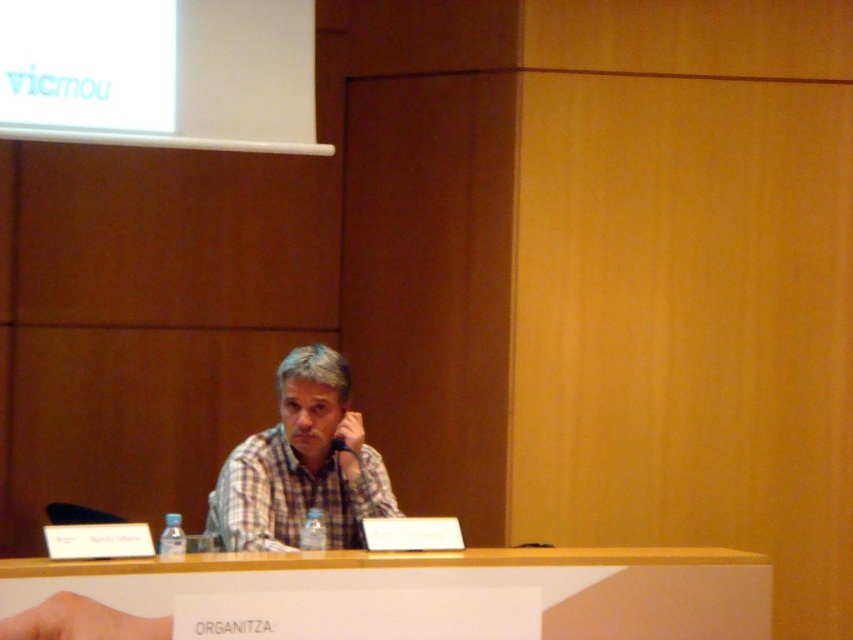
Consider the image. You are organizing a small event and need to place a 1.2 meter long banner on the table. Given that the plaid fabric shirt at center is already on the white wood table at center, can the banner fit on the table?

The white wood table at center has a width larger than the plaid fabric shirt at center. However, the exact dimensions of the table are not provided. Without knowing the table width, it is impossible to determine if the banner will fit.

You are standing in front of the conference table and want to pick up the item closest to you. Which point should you reach for, point 1 at coordinate (550, 598) or point 2 at coordinate (379, 509)?

You should reach for point 1 at coordinate (550, 598) because it is closer to the camera than point 2 at coordinate (379, 509).